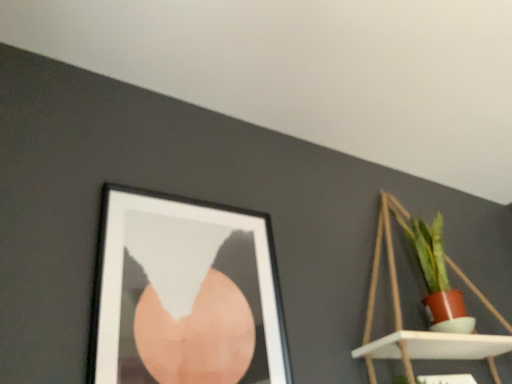
This screenshot has width=512, height=384. Describe the element at coordinates (388, 261) in the screenshot. I see `matte wooden shelf at upper right` at that location.

This screenshot has height=384, width=512. I want to click on matte wooden shelf at upper right, so click(388, 261).

Measure the distance between point (365, 339) and camera.

Point (365, 339) and camera are 4.52 feet apart from each other.

The width and height of the screenshot is (512, 384). I want to click on black matte picture frame at upper left, so click(x=185, y=293).

Describe the element at coordinates (185, 293) in the screenshot. The height and width of the screenshot is (384, 512). I see `black matte picture frame at upper left` at that location.

I want to click on matte wooden shelf at upper right, so click(x=388, y=261).

Based on the photo, is matte wooden shelf at upper right at the right side of black matte picture frame at upper left?

Correct, you'll find matte wooden shelf at upper right to the right of black matte picture frame at upper left.

Based on the photo, is matte wooden shelf at upper right in front of or behind black matte picture frame at upper left in the image?

In the image, matte wooden shelf at upper right appears behind black matte picture frame at upper left.

Which is behind, point (391, 276) or point (131, 243)?

Positioned behind is point (391, 276).

In the scene shown: From the image's perspective, relative to black matte picture frame at upper left, is matte wooden shelf at upper right above or below?

matte wooden shelf at upper right is below black matte picture frame at upper left.

From a real-world perspective, is matte wooden shelf at upper right positioned over black matte picture frame at upper left based on gravity?

Yes, from a real-world perspective, matte wooden shelf at upper right is above black matte picture frame at upper left.

Looking at this image, does matte wooden shelf at upper right have a greater width compared to black matte picture frame at upper left?

Indeed, matte wooden shelf at upper right has a greater width compared to black matte picture frame at upper left.

Is matte wooden shelf at upper right taller or shorter than black matte picture frame at upper left?

In the image, matte wooden shelf at upper right appears to be taller than black matte picture frame at upper left.

Between matte wooden shelf at upper right and black matte picture frame at upper left, which one has larger size?

With larger size is matte wooden shelf at upper right.

Is matte wooden shelf at upper right completely or partially outside of black matte picture frame at upper left?

Indeed, matte wooden shelf at upper right is completely outside black matte picture frame at upper left.

Is matte wooden shelf at upper right directly adjacent to black matte picture frame at upper left?

matte wooden shelf at upper right and black matte picture frame at upper left are clearly separated.

Is matte wooden shelf at upper right oriented towards black matte picture frame at upper left?

No, matte wooden shelf at upper right is not oriented towards black matte picture frame at upper left.

Locate an element on the screen. The width and height of the screenshot is (512, 384). shelf below the black matte picture frame at upper left (from the image's perspective) is located at coordinates (388, 261).

Between black matte picture frame at upper left and matte wooden shelf at upper right, which one appears on the right side from the viewer's perspective?

matte wooden shelf at upper right.

In the image, is black matte picture frame at upper left positioned in front of or behind matte wooden shelf at upper right?

black matte picture frame at upper left is in front of matte wooden shelf at upper right.

Which is closer, [97,342] or [385,229]?

Point [97,342]

From the image's perspective, relative to matte wooden shelf at upper right, is black matte picture frame at upper left above or below?

Clearly, from the image's perspective, black matte picture frame at upper left is above matte wooden shelf at upper right.

From a real-world perspective, is black matte picture frame at upper left located higher than matte wooden shelf at upper right?

Incorrect, from a real-world perspective, black matte picture frame at upper left is lower than matte wooden shelf at upper right.

From the picture: Does black matte picture frame at upper left have a greater width compared to matte wooden shelf at upper right?

Incorrect, the width of black matte picture frame at upper left does not surpass that of matte wooden shelf at upper right.

Does black matte picture frame at upper left have a greater height compared to matte wooden shelf at upper right?

No.

In the scene shown: Is black matte picture frame at upper left bigger or smaller than matte wooden shelf at upper right?

Clearly, black matte picture frame at upper left is smaller in size than matte wooden shelf at upper right.

Consider the image. Is black matte picture frame at upper left located outside matte wooden shelf at upper right?

Yes, black matte picture frame at upper left is located beyond the bounds of matte wooden shelf at upper right.

Is there a large distance between black matte picture frame at upper left and matte wooden shelf at upper right?

No, there isn't a large distance between black matte picture frame at upper left and matte wooden shelf at upper right.

Is black matte picture frame at upper left looking in the opposite direction of matte wooden shelf at upper right?

No, matte wooden shelf at upper right is not at the back of black matte picture frame at upper left.

You are a GUI agent. You are given a task and a screenshot of the screen. Output one action in this format:
    pyautogui.click(x=<x>, y=<y>)
    Task: Click on the picture frame below the matte wooden shelf at upper right (from a real-world perspective)
    
    Given the screenshot: What is the action you would take?
    pyautogui.click(x=185, y=293)

Find the location of `picture frame in front of the matte wooden shelf at upper right`. picture frame in front of the matte wooden shelf at upper right is located at coordinates (185, 293).

The image size is (512, 384). In order to click on picture frame below the matte wooden shelf at upper right (from a real-world perspective) in this screenshot , I will do point(185,293).